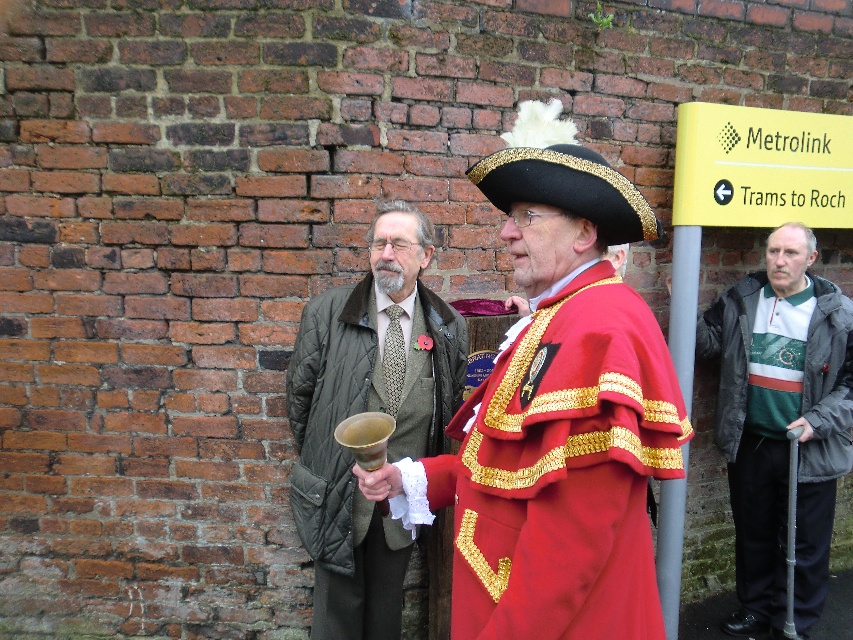
Can you confirm if shiny gold bell at center is smaller than green and white sweater at right?

Correct, shiny gold bell at center occupies less space than green and white sweater at right.

Does point (558, 333) come farther from viewer compared to point (779, 556)?

No, (558, 333) is closer to viewer.

This screenshot has width=853, height=640. I want to click on shiny gold bell at center, so click(561, 412).

Measure the distance from shiny gold bell at center to quilted fabric coat at center.

shiny gold bell at center and quilted fabric coat at center are 35.65 inches apart.

In the scene shown: Between shiny gold bell at center and quilted fabric coat at center, which one is positioned lower?

Positioned lower is quilted fabric coat at center.

Is point (554, 246) in front of point (349, 504)?

Yes, it is.

Locate an element on the screen. shiny gold bell at center is located at coordinates (561, 412).

Between quilted fabric coat at center and green and white sweater at right, which one appears on the left side from the viewer's perspective?

From the viewer's perspective, quilted fabric coat at center appears more on the left side.

In the scene shown: Does quilted fabric coat at center appear on the right side of green and white sweater at right?

In fact, quilted fabric coat at center is to the left of green and white sweater at right.

Between point (390, 339) and point (805, 432), which one is positioned behind?

Point (805, 432)

Identify the location of quilted fabric coat at center. (368, 410).